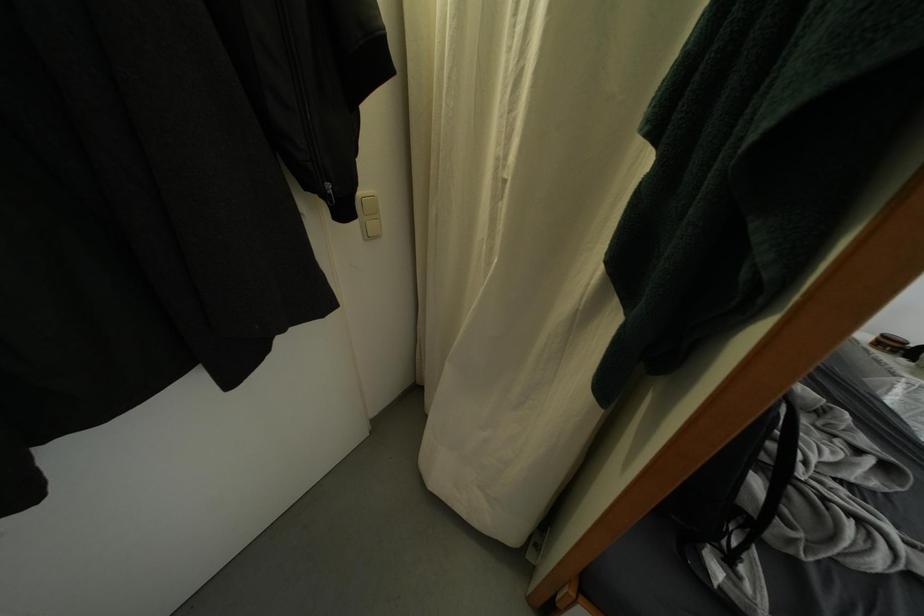
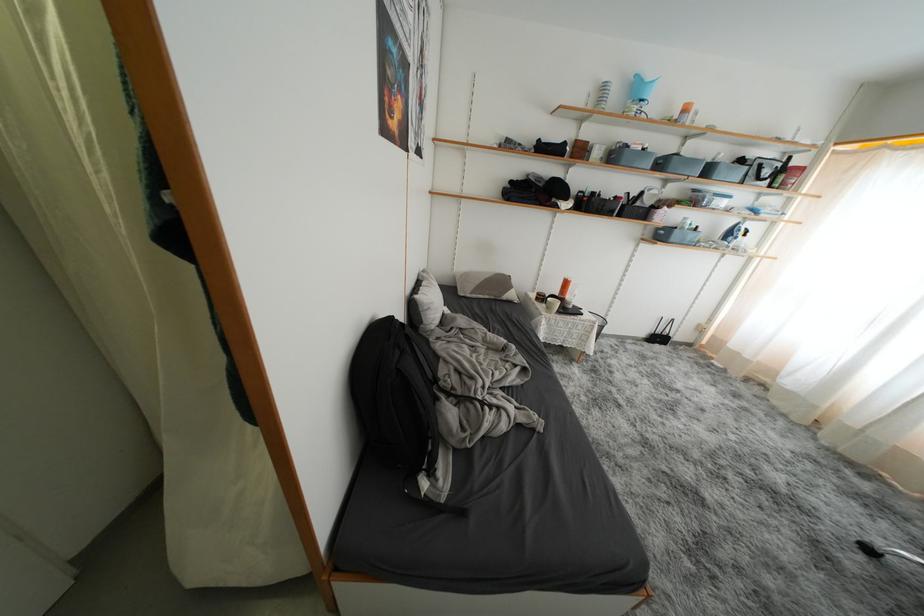
Question: The images are taken continuously from a first-person perspective. In which direction is your viewpoint rotating?

Choices:
 (A) Left
 (B) Right
 (C) Up
 (D) Down

Answer: (B)